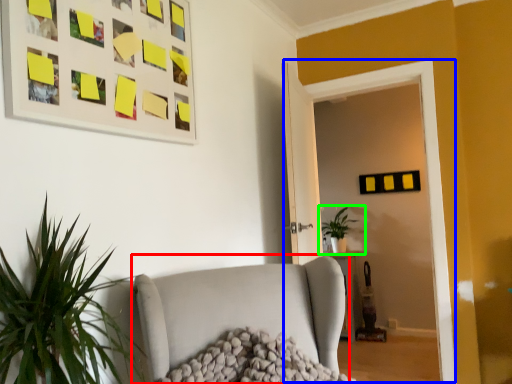
Question: Based on their relative distances, which object is nearer to studio couch (highlighted by a red box)? Choose from glass door (highlighted by a blue box) and houseplant (highlighted by a green box).

Choices:
 (A) glass door
 (B) houseplant

Answer: (A)